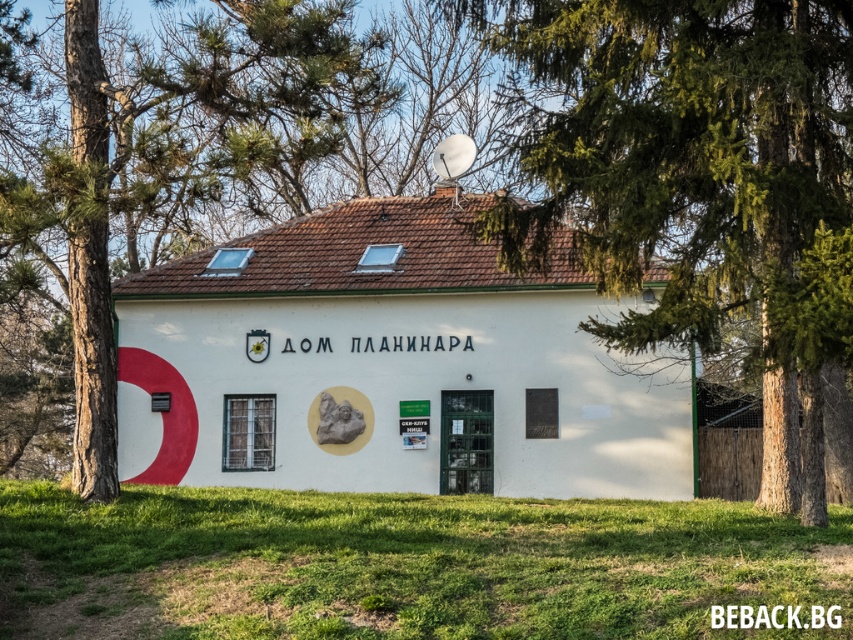
Does green grass at lower center appear under brown textured tree at left?

Yes, green grass at lower center is below brown textured tree at left.

Consider the image. Which of these two, green grass at lower center or brown textured tree at left, stands taller?

brown textured tree at left is taller.

At what (x,y) coordinates should I click in order to perform the action: click on green grass at lower center. Please return your answer as a coordinate pair (x, y). The image size is (853, 640). Looking at the image, I should click on (403, 564).

Is green textured tree at center closer to the viewer compared to green grass at lower center?

That is False.

Is point (786, 436) positioned behind point (659, 536)?

Yes, point (786, 436) is behind point (659, 536).

You are a GUI agent. You are given a task and a screenshot of the screen. Output one action in this format:
    pyautogui.click(x=<x>, y=<y>)
    Task: Click on the green textured tree at center
    The width and height of the screenshot is (853, 640).
    Given the screenshot: What is the action you would take?
    pyautogui.click(x=700, y=184)

Looking at this image, measure the distance between green textured tree at center and camera.

They are 50.32 feet apart.

Can you confirm if green textured tree at center is bigger than brown textured tree at left?

Incorrect, green textured tree at center is not larger than brown textured tree at left.

I want to click on green textured tree at center, so click(700, 184).